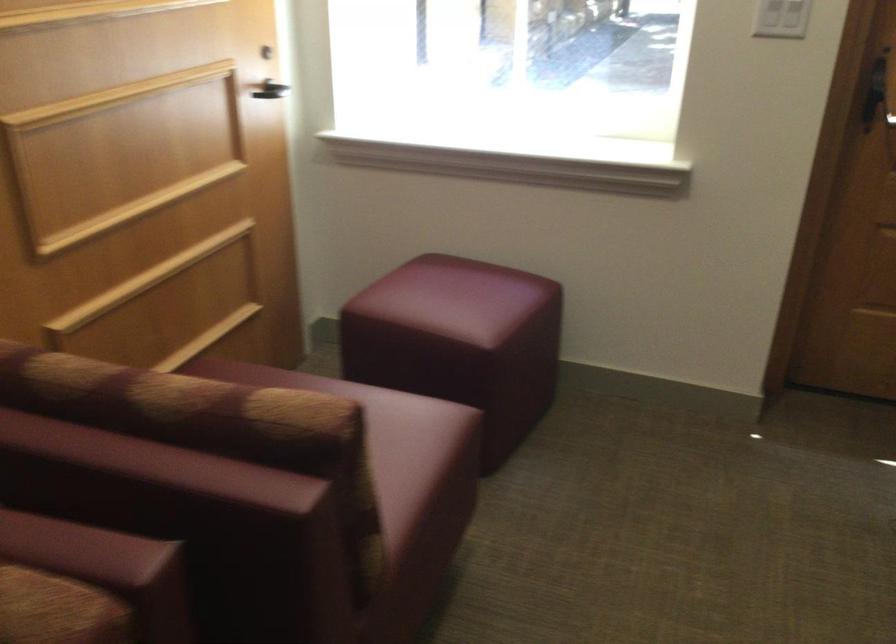
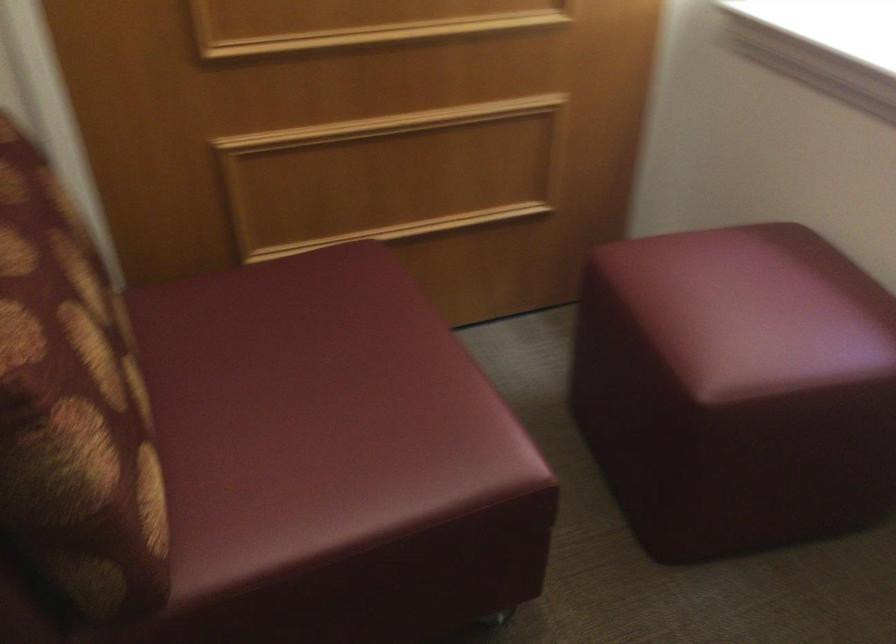
Locate, in the second image, the point that corresponds to point 469,297 in the first image.

(752, 308)